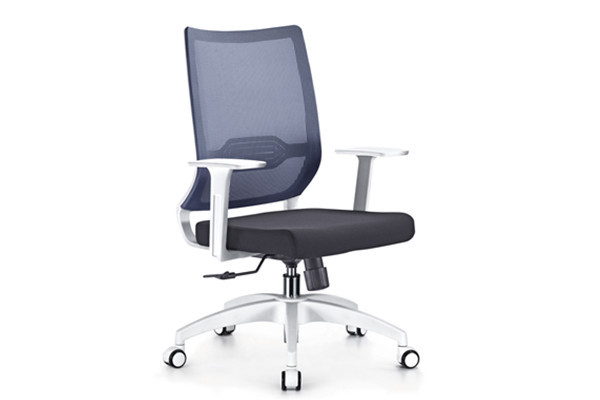
This screenshot has width=600, height=400. I want to click on 1 black seat cushion, so click(311, 225).